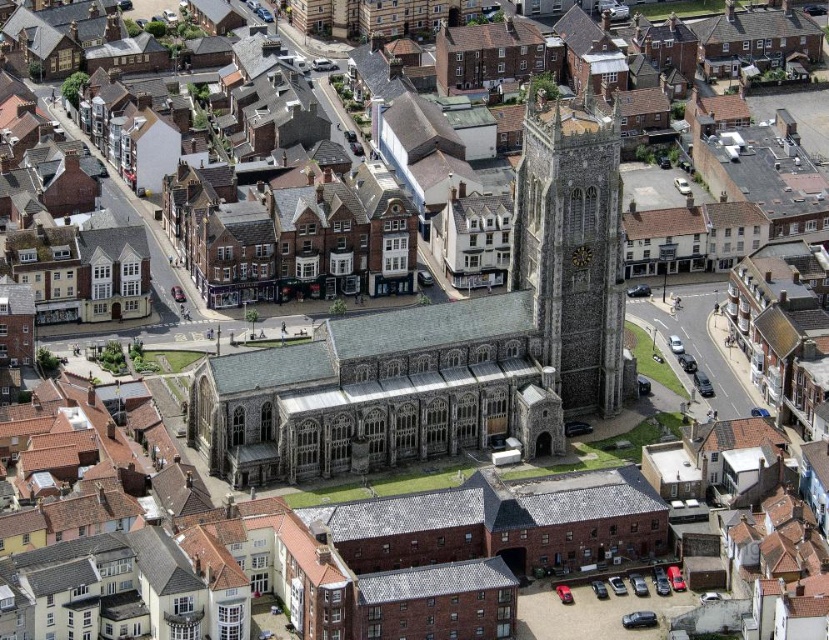
Question: Which object is farther from the camera taking this photo?

Choices:
 (A) stone church at center
 (B) stone clock tower at center

Answer: (B)

Question: Is stone church at center behind stone clock tower at center?

Choices:
 (A) no
 (B) yes

Answer: (A)

Question: Which point appears closest to the camera in this image?

Choices:
 (A) (292, 410)
 (B) (582, 392)

Answer: (A)

Question: Does stone church at center appear under stone clock tower at center?

Choices:
 (A) yes
 (B) no

Answer: (A)

Question: In this image, where is stone church at center located relative to stone clock tower at center?

Choices:
 (A) below
 (B) above

Answer: (A)